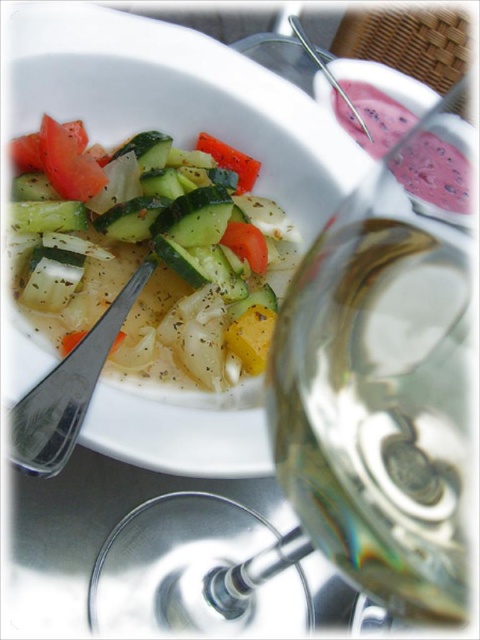
Question: Does fresh green salad at center appear under pink smoothie at upper right?

Choices:
 (A) no
 (B) yes

Answer: (B)

Question: Which is farther from the fresh green salad at center?

Choices:
 (A) satin silver fork at lower left
 (B) orange smooth carrot at center

Answer: (B)

Question: Which object is closer to the camera taking this photo?

Choices:
 (A) pink smoothie at upper right
 (B) fresh green salad at center
 (C) satin silver fork at lower left

Answer: (C)

Question: In this image, where is fresh green salad at center located relative to pink smoothie at upper right?

Choices:
 (A) below
 (B) above

Answer: (A)

Question: Can you confirm if fresh green salad at center is bigger than orange smooth carrot at center?

Choices:
 (A) no
 (B) yes

Answer: (B)

Question: Which point is closer to the camera?

Choices:
 (A) (372, 90)
 (B) (302, 456)

Answer: (B)